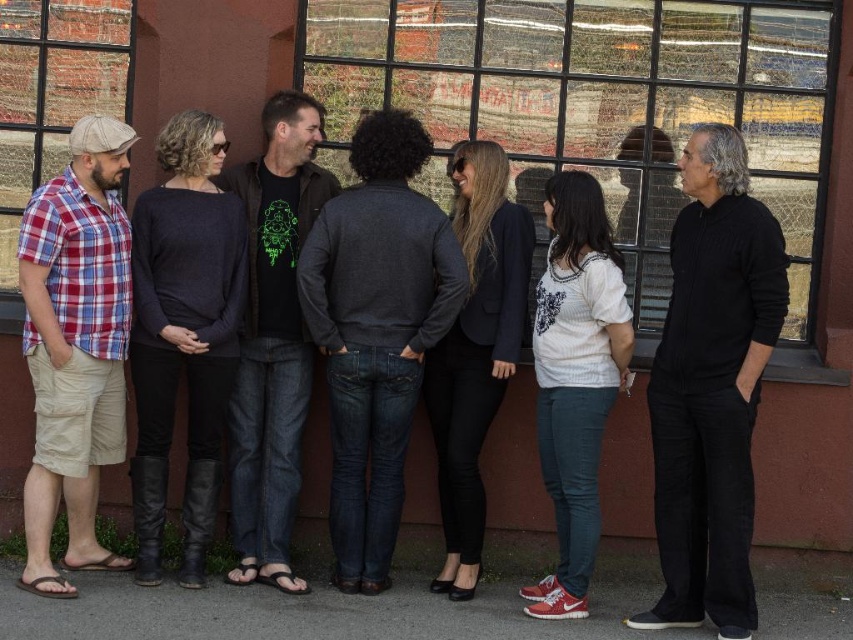
Measure the distance between plaid cotton shirt at left and dark gray sweater at center.

plaid cotton shirt at left is 30.70 inches from dark gray sweater at center.

In the scene shown: Who is more forward, (24, 320) or (248, 536)?

Point (248, 536) is more forward.

Is point (68, 264) closer to viewer compared to point (251, 476)?

Yes, point (68, 264) is in front of point (251, 476).

Where is `plaid cotton shirt at left`? plaid cotton shirt at left is located at coordinates (74, 346).

Describe the element at coordinates (711, 387) in the screenshot. Image resolution: width=853 pixels, height=640 pixels. I see `black matte sweater at right` at that location.

Image resolution: width=853 pixels, height=640 pixels. What do you see at coordinates (711, 387) in the screenshot?
I see `black matte sweater at right` at bounding box center [711, 387].

Locate an element on the screen. The width and height of the screenshot is (853, 640). black matte sweater at right is located at coordinates (711, 387).

Which of these two, glass window at center or plaid cotton shirt at left, stands shorter?

Standing shorter between the two is glass window at center.

Is glass window at center to the right of plaid cotton shirt at left from the viewer's perspective?

Indeed, glass window at center is positioned on the right side of plaid cotton shirt at left.

Who is more distant from viewer, (781, 109) or (57, 289)?

Point (781, 109)

I want to click on glass window at center, so click(601, 102).